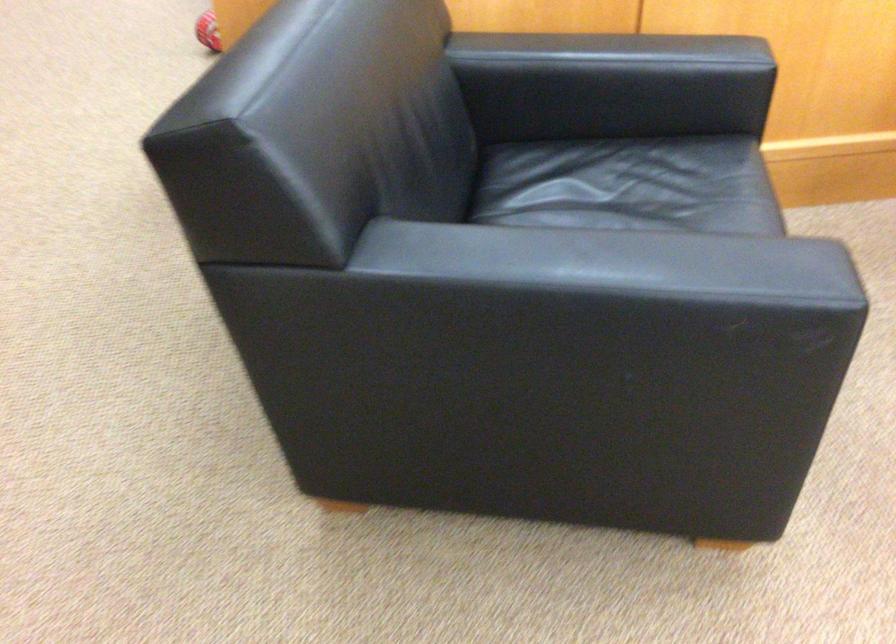
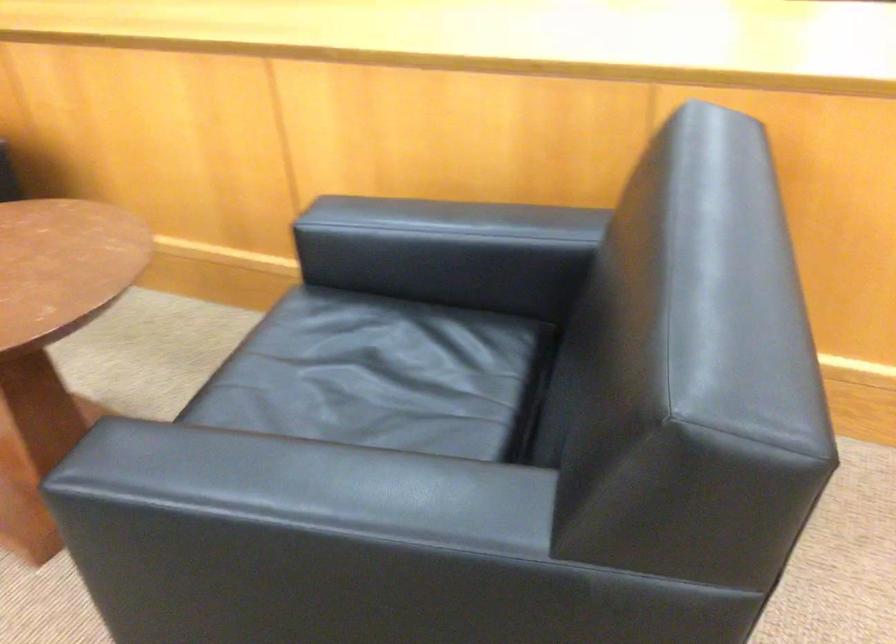
Question: In a continuous first-person perspective shot, in which direction is the camera moving?

Choices:
 (A) Left
 (B) Right
 (C) Forward
 (D) Backward

Answer: (B)